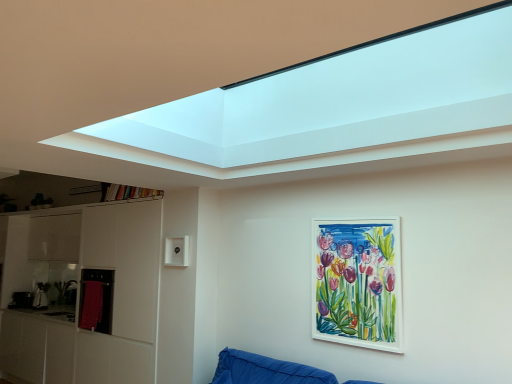
Question: Considering the relative sizes of red towel at left and white matte picture frame at center-right in the image provided, is red towel at left thinner than white matte picture frame at center-right?

Choices:
 (A) no
 (B) yes

Answer: (A)

Question: Is white matte picture frame at center-right surrounded by red towel at left?

Choices:
 (A) yes
 (B) no

Answer: (B)

Question: Does red towel at left touch white matte picture frame at center-right?

Choices:
 (A) yes
 (B) no

Answer: (B)

Question: From the image's perspective, is red towel at left below white matte picture frame at center-right?

Choices:
 (A) no
 (B) yes

Answer: (B)

Question: Can you confirm if red towel at left is positioned to the left of white matte picture frame at center-right?

Choices:
 (A) no
 (B) yes

Answer: (B)

Question: Is red towel at left bigger than white matte picture frame at center-right?

Choices:
 (A) yes
 (B) no

Answer: (A)

Question: Is white matte picture frame at center-right in contact with red towel at left?

Choices:
 (A) no
 (B) yes

Answer: (A)

Question: Does white matte picture frame at center-right have a lesser height compared to red towel at left?

Choices:
 (A) yes
 (B) no

Answer: (B)

Question: Is white matte picture frame at center-right further to the viewer compared to red towel at left?

Choices:
 (A) no
 (B) yes

Answer: (A)

Question: From the image's perspective, is white matte picture frame at center-right located beneath red towel at left?

Choices:
 (A) no
 (B) yes

Answer: (A)

Question: From a real-world perspective, is white matte picture frame at center-right over red towel at left?

Choices:
 (A) yes
 (B) no

Answer: (A)

Question: Is white matte picture frame at center-right to the right of red towel at left from the viewer's perspective?

Choices:
 (A) yes
 (B) no

Answer: (A)

Question: Is white matte picture frame at center-right to the left or to the right of red towel at left in the image?

Choices:
 (A) left
 (B) right

Answer: (B)